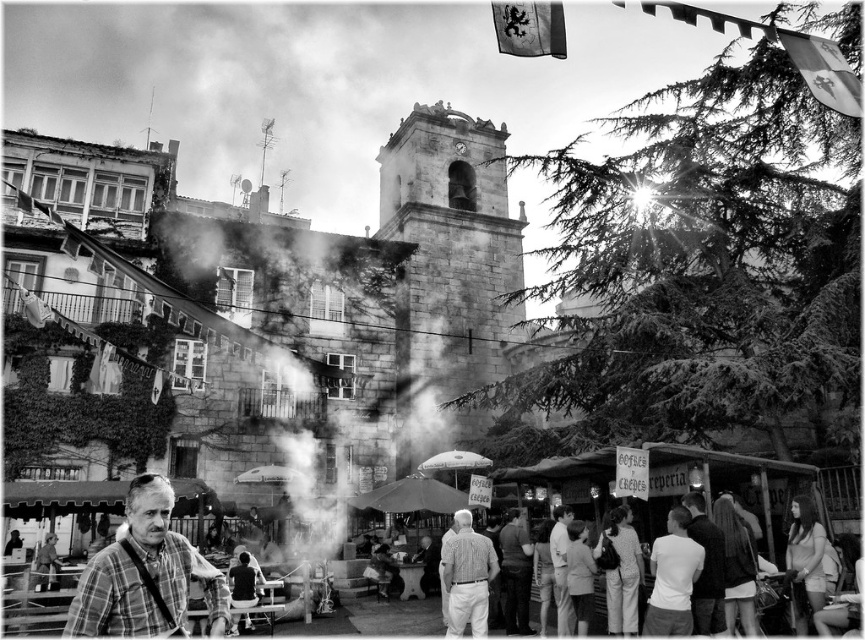
You are a delivery person standing at the edge of the square and need to deliver a package to the person wearing the dark gray fabric jacket at center. There is a white matte umbrella at center in your path. Can you walk straight to the jacket without moving the umbrella?

The distance between the dark gray fabric jacket at center and the white matte umbrella at center is 19.50 meters, so you can walk straight to the jacket without moving the umbrella since they are not close to each other.

You are a photographer trying to capture a clear shot of the dark gray fabric jacket at center and the light gray fabric shirt at center. Since you want both subjects to be fully visible in your frame, which one should you focus on to ensure the widest part of each is captured without cropping?

The dark gray fabric jacket at center might be wider than the light gray fabric shirt at center, so you should focus on capturing the dark gray fabric jacket at center first to ensure its widest part fits in the frame, then adjust to include the light gray fabric shirt at center.